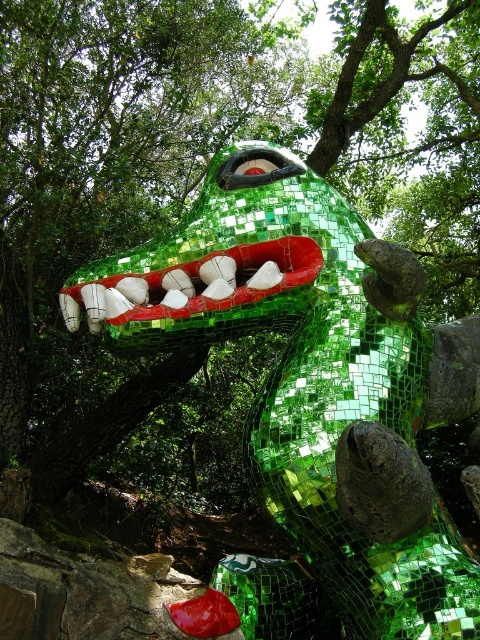
Is green mosaic dragon at center smaller than shiny green mosaic mouth at center?

Incorrect, green mosaic dragon at center is not smaller in size than shiny green mosaic mouth at center.

Which is more to the left, green mosaic dragon at center or shiny green mosaic mouth at center?

shiny green mosaic mouth at center is more to the left.

Which is in front, point (188, 323) or point (190, 310)?

Point (190, 310) is in front.

Find the location of a particular element. This screenshot has height=640, width=480. green mosaic dragon at center is located at coordinates (295, 394).